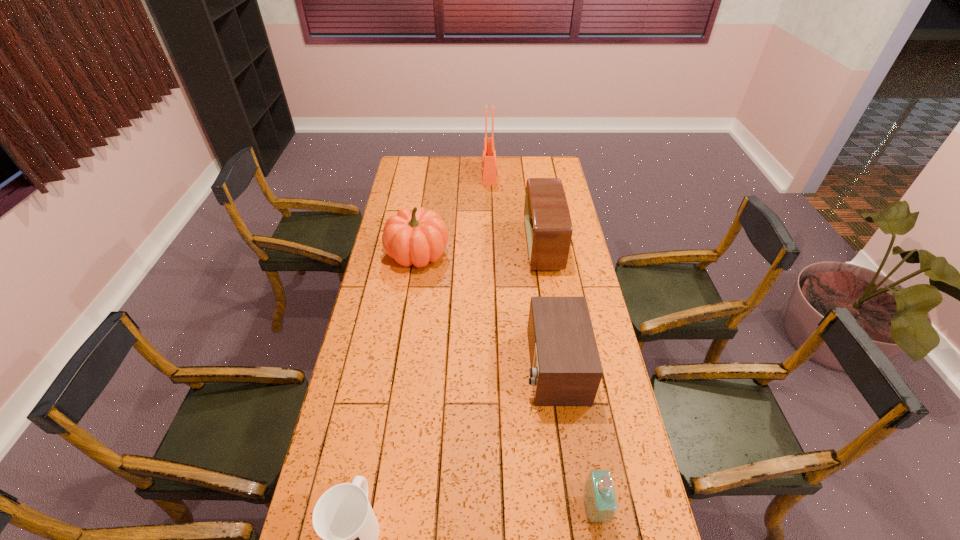
Identify which object is the third nearest to the mug. Please provide its 2D coordinates. Your answer should be formatted as a tuple, i.e. [(x, y)], where the tuple contains the x and y coordinates of a point satisfying the conditions above.

[(417, 237)]